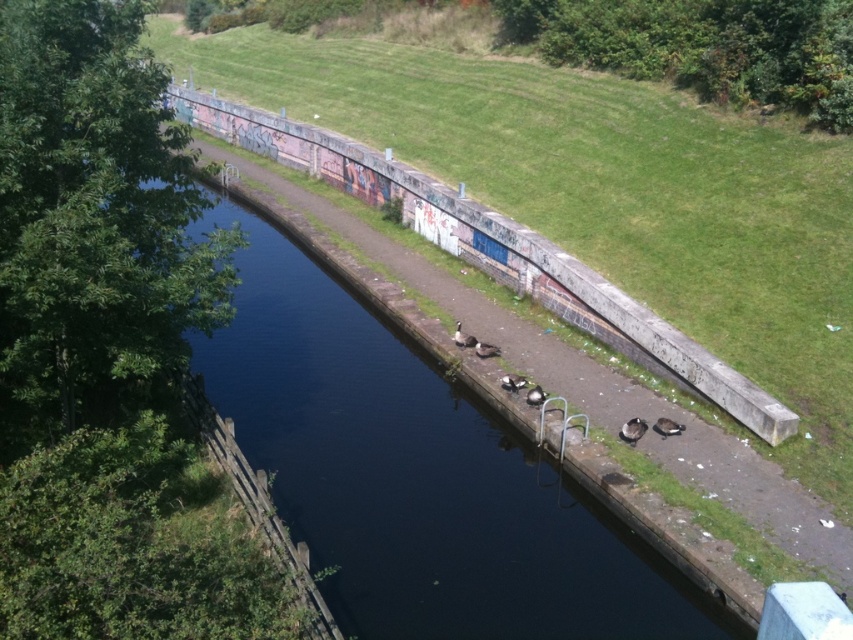
You are a pedestrian walking along the canal path. You see the dark concrete river at center and the brown fuzzy duck at lower center. Which object is closer to you as you face the canal?

The brown fuzzy duck at lower center is closer to you because it is located below the dark concrete river at center, which is positioned above it.

You are a delivery person with a cart that is 1 meter wide. You need to cross the dark concrete river at center to reach the other side. Can your cart fit across the river if the brown fuzzy duck at lower right is currently occupying part of the river? Please explain your reasoning based on the scene description.

The dark concrete river at center is wider than the brown fuzzy duck at lower right, so even if the duck is occupying part of the river, there should still be enough space for the 1 meter wide cart to cross safely as long as the duck isn not blocking the entire width.